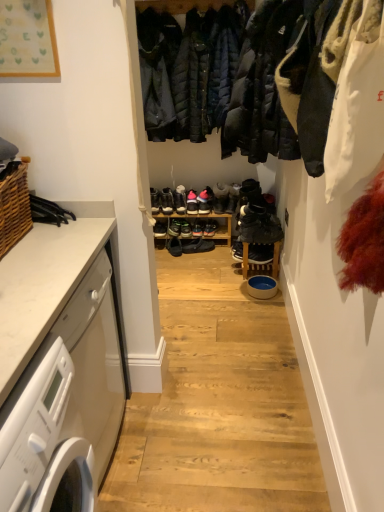
Question: Should I look upward or downward to see shiny black sneaker at center, the second footwear when ordered from right to left?

Choices:
 (A) down
 (B) up

Answer: (B)

Question: Is white marble countertop at left located outside matte black sneaker at center?

Choices:
 (A) no
 (B) yes

Answer: (B)

Question: From the image's perspective, is white marble countertop at left above matte black sneaker at center?

Choices:
 (A) yes
 (B) no

Answer: (B)

Question: Is matte black sneaker at center located within white marble countertop at left?

Choices:
 (A) no
 (B) yes

Answer: (A)

Question: Considering the relative sizes of white marble countertop at left and matte black sneaker at center in the image provided, is white marble countertop at left thinner than matte black sneaker at center?

Choices:
 (A) yes
 (B) no

Answer: (B)

Question: Does white marble countertop at left have a lesser height compared to matte black sneaker at center?

Choices:
 (A) no
 (B) yes

Answer: (A)

Question: Is white marble countertop at left next to matte black sneaker at center?

Choices:
 (A) no
 (B) yes

Answer: (A)

Question: Does black suede shoes at center, the 8th footwear viewed from the left, have a lesser width compared to shiny black sneaker at center, which appears as the 7th footwear when viewed from the left?

Choices:
 (A) no
 (B) yes

Answer: (A)

Question: Is black suede shoes at center, the 8th footwear viewed from the left, to the left of shiny black sneaker at center, the second footwear when ordered from right to left, from the viewer's perspective?

Choices:
 (A) no
 (B) yes

Answer: (A)

Question: Is there a large distance between black suede shoes at center, the 8th footwear viewed from the left, and shiny black sneaker at center, the second footwear when ordered from right to left?

Choices:
 (A) no
 (B) yes

Answer: (A)

Question: Considering the relative positions of black suede shoes at center, the 1th footwear viewed from the right, and shiny black sneaker at center, the second footwear when ordered from right to left, in the image provided, is black suede shoes at center, the 1th footwear viewed from the right, to the right of shiny black sneaker at center, the second footwear when ordered from right to left, from the viewer's perspective?

Choices:
 (A) no
 (B) yes

Answer: (B)

Question: Is black suede shoes at center, the 1th footwear viewed from the right, looking in the opposite direction of shiny black sneaker at center, the second footwear when ordered from right to left?

Choices:
 (A) no
 (B) yes

Answer: (A)

Question: Does black suede shoes at center, the 8th footwear viewed from the left, have a smaller size compared to shiny black sneaker at center, which appears as the 7th footwear when viewed from the left?

Choices:
 (A) no
 (B) yes

Answer: (A)

Question: Can you confirm if white marble countertop at left is smaller than shiny black sneaker at center, marked as the 6th footwear in a right-to-left arrangement?

Choices:
 (A) no
 (B) yes

Answer: (A)